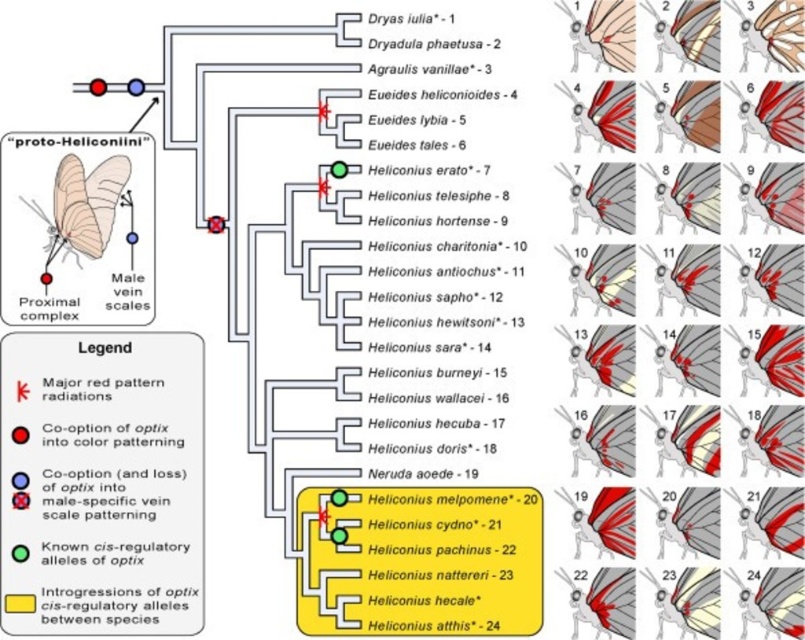
Question: Considering the real-world distances, which object is farthest from the major red pattern radiations at upper center?

Choices:
 (A) matte black male vein scales at center
 (B) matte white butterfly at upper left

Answer: (B)

Question: Is dryas iulia* - 1 at upper left smaller than major red pattern radiations at upper center?

Choices:
 (A) no
 (B) yes

Answer: (A)

Question: Is major red pattern radiations at upper center closer to the viewer compared to matte white butterfly at upper left?

Choices:
 (A) yes
 (B) no

Answer: (A)

Question: Observing the image, what is the correct spatial positioning of major red pattern radiations at upper center in reference to matte white butterfly at upper left?

Choices:
 (A) left
 (B) right

Answer: (B)

Question: Estimate the real-world distances between objects in this image. Which object is closer to the matte white butterfly at upper left?

Choices:
 (A) major red pattern radiations at upper center
 (B) dryas iulia* - 1 at upper left
 (C) matte black male vein scales at center

Answer: (C)

Question: Which point appears closest to the camera in this image?

Choices:
 (A) (58, 404)
 (B) (124, 292)
 (C) (402, 316)

Answer: (A)